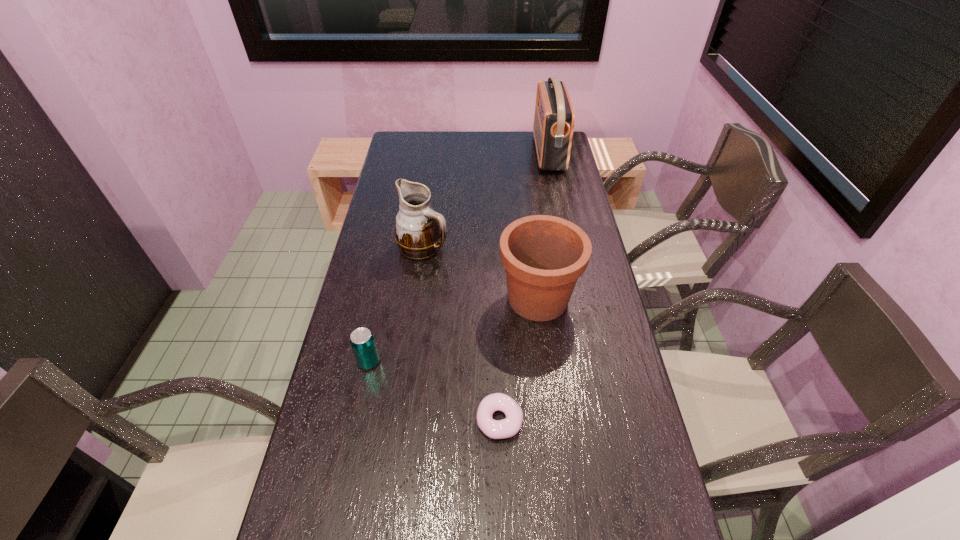
Where is `object at the far right corner`? The image size is (960, 540). object at the far right corner is located at coordinates (554, 118).

You are a GUI agent. You are given a task and a screenshot of the screen. Output one action in this format:
    pyautogui.click(x=<x>, y=<y>)
    Task: Click on the vacant space at the far edge of the desktop
    
    Given the screenshot: What is the action you would take?
    pyautogui.click(x=441, y=151)

I want to click on blank space at the left edge, so click(332, 491).

Find the location of a particular element. The width and height of the screenshot is (960, 540). free space at the right edge is located at coordinates (599, 291).

Locate an element on the screen. vacant position at the far left corner of the desktop is located at coordinates (398, 131).

At what (x,y) coordinates should I click in order to perform the action: click on vacant region between the radio receiver and the beer can. Please return your answer as a coordinate pair (x, y). This screenshot has height=540, width=960. Looking at the image, I should click on (459, 258).

Where is `free area in between the tallest object and the pitcher`? The width and height of the screenshot is (960, 540). free area in between the tallest object and the pitcher is located at coordinates (486, 200).

The width and height of the screenshot is (960, 540). In order to click on vacant space that's between the nearest object and the third farthest object in this screenshot , I will do `click(518, 359)`.

This screenshot has height=540, width=960. I want to click on blank region between the second farthest object and the doughnut, so click(462, 333).

The width and height of the screenshot is (960, 540). In order to click on free spot between the tallest object and the beer can in this screenshot , I will do `click(459, 258)`.